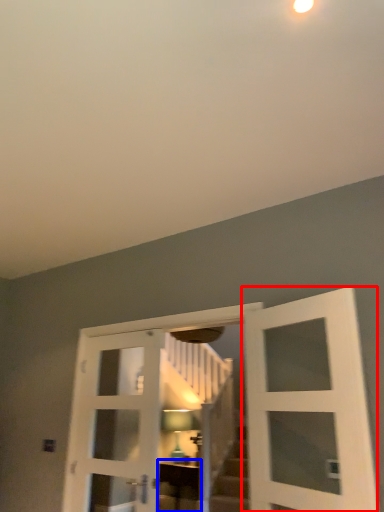
Question: Which point is closer to the camera, door (highlighted by a red box) or furniture (highlighted by a blue box)?

Choices:
 (A) door
 (B) furniture

Answer: (A)